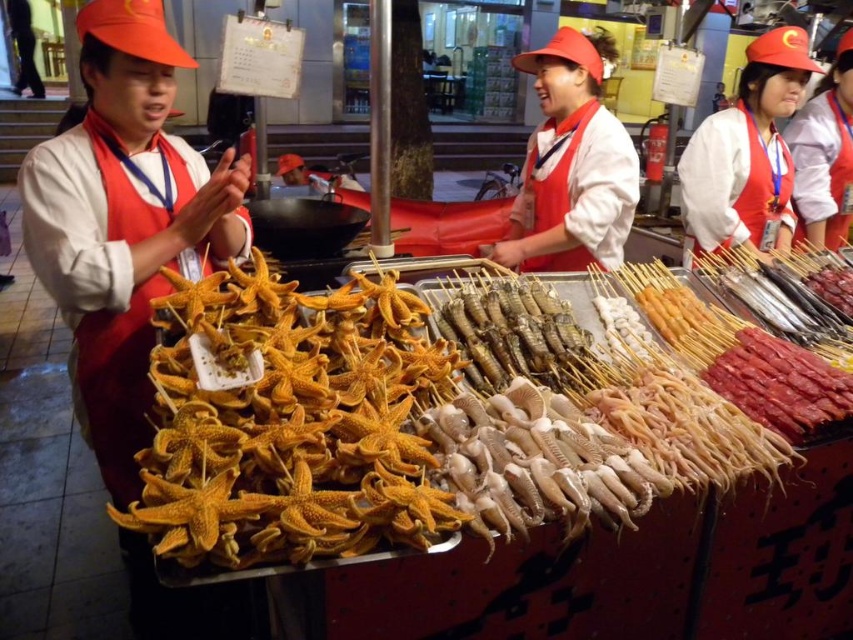
Question: Is golden starfish at center above orange fabric apron at left?

Choices:
 (A) no
 (B) yes

Answer: (B)

Question: Which object is closer to the camera taking this photo?

Choices:
 (A) orange fabric apron at left
 (B) matte red hat at upper right

Answer: (A)

Question: Observing the image, what is the correct spatial positioning of orange fabric apron at left in reference to matte red apron at center?

Choices:
 (A) right
 (B) left

Answer: (B)

Question: Which point is closer to the camera?

Choices:
 (A) (724, 228)
 (B) (97, 348)
 (C) (221, 336)

Answer: (C)

Question: Which object is closer to the camera taking this photo?

Choices:
 (A) golden starfish at center
 (B) orange fabric apron at left
 (C) matte red hat at upper right

Answer: (A)

Question: Can you confirm if golden starfish at center is smaller than matte red hat at upper right?

Choices:
 (A) no
 (B) yes

Answer: (A)